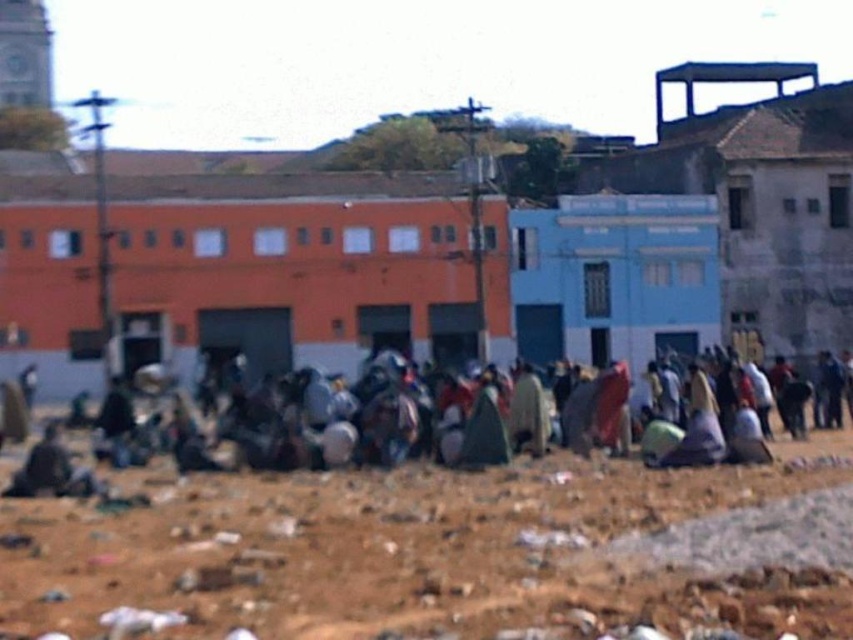
Is brown sandy dirt at center thinner than green fabric cloth at center?

Correct, brown sandy dirt at center's width is less than green fabric cloth at center's.

Is the position of brown sandy dirt at center more distant than that of green fabric cloth at center?

No, it is in front of green fabric cloth at center.

The image size is (853, 640). I want to click on brown sandy dirt at center, so click(448, 552).

The height and width of the screenshot is (640, 853). In order to click on brown sandy dirt at center in this screenshot , I will do `click(448, 552)`.